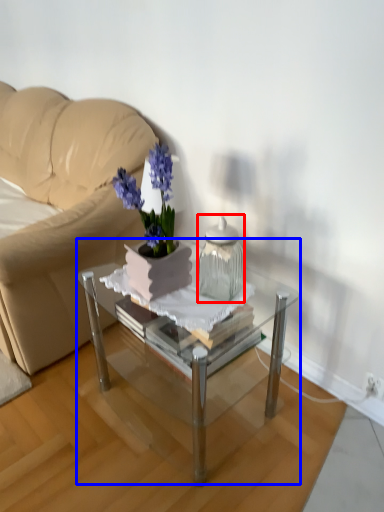
Question: Which of the following is the closest to the observer, vase (highlighted by a red box) or coffee table (highlighted by a blue box)?

Choices:
 (A) vase
 (B) coffee table

Answer: (B)